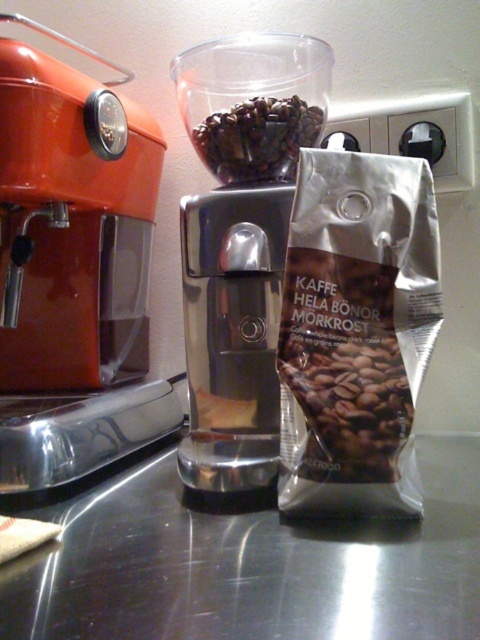
Question: Which of the following is the closest to the observer?

Choices:
 (A) silver metallic coffee bag at lower right
 (B) dark matte coffee beans at center
 (C) transparent plastic blender at center
 (D) orange glossy coffee machine at left

Answer: (A)

Question: Which of the following is the closest to the observer?

Choices:
 (A) orange glossy coffee machine at left
 (B) silver metallic coffee bag at lower right

Answer: (B)

Question: Is orange glossy coffee machine at left bigger than transparent plastic blender at center?

Choices:
 (A) no
 (B) yes

Answer: (B)

Question: Is orange glossy coffee machine at left thinner than transparent plastic blender at center?

Choices:
 (A) no
 (B) yes

Answer: (A)

Question: Is silver metallic coffee bag at lower right to the left of dark matte coffee beans at center from the viewer's perspective?

Choices:
 (A) yes
 (B) no

Answer: (B)

Question: Which of the following is the farthest from the observer?

Choices:
 (A) (292, 76)
 (B) (48, 211)
 (C) (403, 465)

Answer: (A)